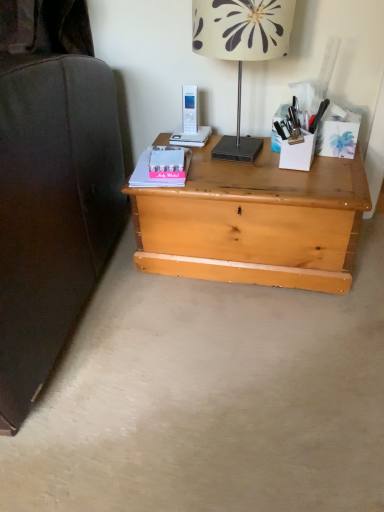
This screenshot has height=512, width=384. I want to click on vacant area in front of white plastic pen holder at upper right, so click(x=312, y=175).